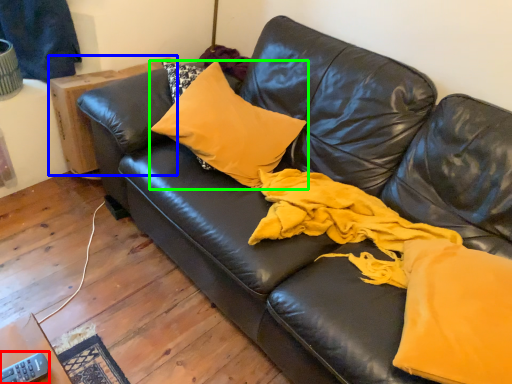
Question: Based on their relative distances, which object is farther from remote (highlighted by a red box)? Choose from table (highlighted by a blue box) and pillow (highlighted by a green box).

Choices:
 (A) table
 (B) pillow

Answer: (A)